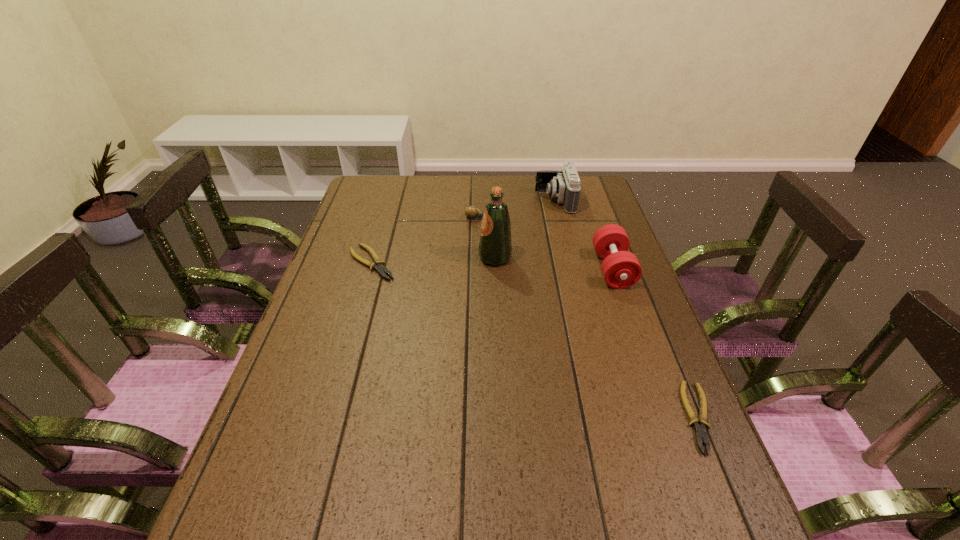
Find the location of a particular element. vacant region located on the back of the right pliers is located at coordinates (668, 343).

You are a GUI agent. You are given a task and a screenshot of the screen. Output one action in this format:
    pyautogui.click(x=<x>, y=<y>)
    Task: Click on the free space located at the front of the fourth object from left to right with an open lens cover
    Image resolution: width=960 pixels, height=540 pixels.
    Given the screenshot: What is the action you would take?
    pyautogui.click(x=487, y=201)

This screenshot has width=960, height=540. In order to click on free space located at the front of the fourth object from left to right with an open lens cover in this screenshot , I will do `click(500, 201)`.

Where is `free space located at the front of the fourth object from left to right with an open lens cover`? The width and height of the screenshot is (960, 540). free space located at the front of the fourth object from left to right with an open lens cover is located at coordinates (522, 201).

Locate an element on the screen. free region located on the front-facing side of the third shortest object is located at coordinates (580, 218).

Identify the location of free space located 0.360m on the back of the dumbbell. (586, 191).

Where is `vacant space situated on the front-facing side of the olive oil`? Image resolution: width=960 pixels, height=540 pixels. vacant space situated on the front-facing side of the olive oil is located at coordinates (420, 258).

Find the location of a particular element. The height and width of the screenshot is (540, 960). free space located on the front-facing side of the olive oil is located at coordinates (369, 258).

Locate an element on the screen. The width and height of the screenshot is (960, 540). vacant space located 0.240m on the front-facing side of the olive oil is located at coordinates (400, 258).

Image resolution: width=960 pixels, height=540 pixels. I want to click on object located in the far edge section of the desktop, so click(564, 185).